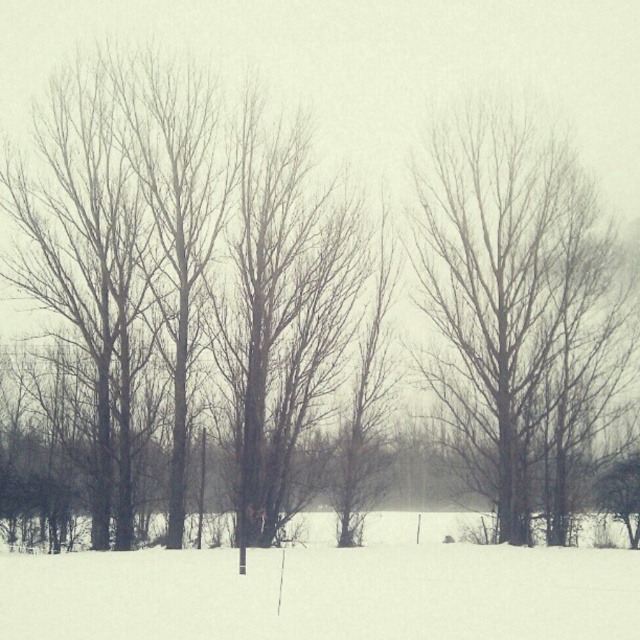
Question: Which of the following is the farthest from the observer?

Choices:
 (A) bare wood tree at right
 (B) white powdery snow at lower center

Answer: (A)

Question: Is bare wood tree at right wider than white powdery snow at lower center?

Choices:
 (A) yes
 (B) no

Answer: (B)

Question: Does bare wood tree at right come in front of white powdery snow at lower center?

Choices:
 (A) no
 (B) yes

Answer: (A)

Question: Can you confirm if bare wood tree at right is positioned to the right of white powdery snow at lower center?

Choices:
 (A) no
 (B) yes

Answer: (B)

Question: Which of the following is the farthest from the observer?

Choices:
 (A) white powdery snow at lower center
 (B) bare wood tree at right

Answer: (B)

Question: Which point is farther to the camera?

Choices:
 (A) (67, 604)
 (B) (566, 310)

Answer: (B)